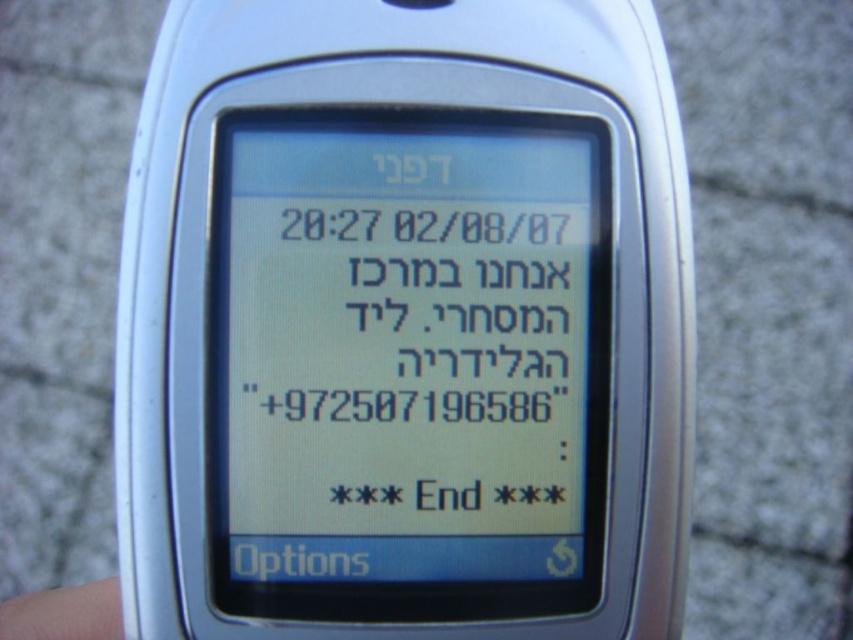
Question: Does silver metallic phone at center have a lesser width compared to white matte text message at center?

Choices:
 (A) yes
 (B) no

Answer: (B)

Question: Based on their relative distances, which object is nearer to the skin smooth finger at lower left?

Choices:
 (A) silver metallic phone at center
 (B) white matte text message at center

Answer: (B)

Question: Can you confirm if silver metallic phone at center is positioned to the right of white matte text message at center?

Choices:
 (A) yes
 (B) no

Answer: (B)

Question: Which point is farther to the camera?

Choices:
 (A) silver metallic phone at center
 (B) white matte text message at center

Answer: (B)

Question: Can you confirm if white matte text message at center is positioned to the left of skin smooth finger at lower left?

Choices:
 (A) no
 (B) yes

Answer: (A)

Question: Among these points, which one is farthest from the camera?

Choices:
 (A) (111, 605)
 (B) (329, 248)
 (C) (502, 385)

Answer: (A)